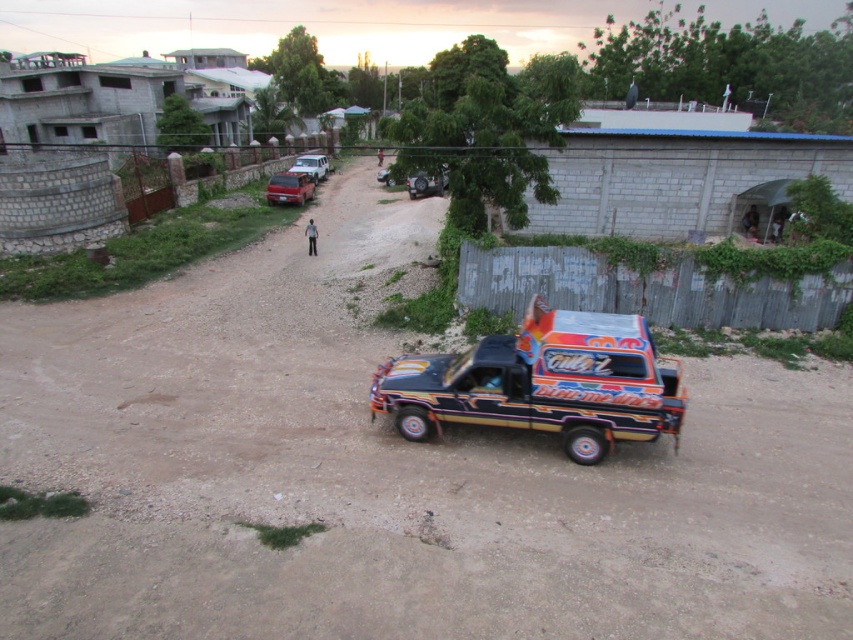
Question: Which of the following is the farthest from the observer?

Choices:
 (A) (279, 172)
 (B) (305, 161)

Answer: (A)

Question: Does painted wood monster truck at center appear over white matte car at upper center?

Choices:
 (A) yes
 (B) no

Answer: (B)

Question: Observing the image, what is the correct spatial positioning of painted wood monster truck at center in reference to metallic red car at upper left?

Choices:
 (A) above
 (B) below

Answer: (B)

Question: Which object is the farthest from the white matte car at upper center?

Choices:
 (A) painted wood monster truck at center
 (B) metallic red car at upper left

Answer: (A)

Question: Can you confirm if painted wood monster truck at center is smaller than metallic red car at upper left?

Choices:
 (A) yes
 (B) no

Answer: (B)

Question: Which point appears farthest from the camera in this image?

Choices:
 (A) (281, 188)
 (B) (680, 400)
 (C) (325, 173)

Answer: (C)